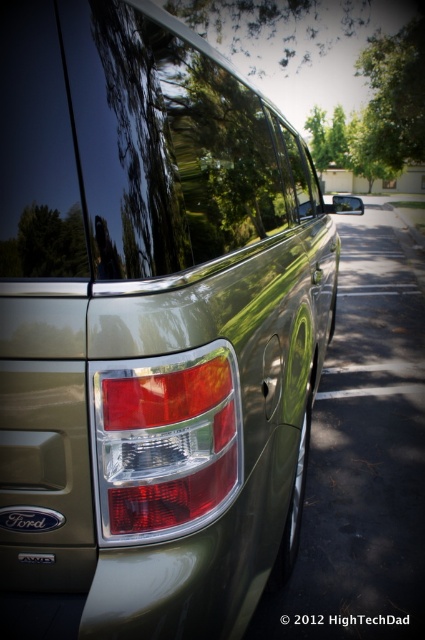
Question: Among these points, which one is farthest from the camera?

Choices:
 (A) (170, 488)
 (B) (190, 52)

Answer: (B)

Question: Which of the following is the farthest from the observer?

Choices:
 (A) (186, 76)
 (B) (384, 67)
 (C) (156, 444)

Answer: (B)

Question: Which object is the closest to the green leafy tree at upper center?

Choices:
 (A) matte plastic tail light at center
 (B) glossy metallic car window at center

Answer: (A)

Question: Is glossy metallic car window at center further to the viewer compared to black plastic license plate at lower center?

Choices:
 (A) no
 (B) yes

Answer: (A)

Question: Can you confirm if glossy metallic car window at center is smaller than black plastic license plate at lower center?

Choices:
 (A) yes
 (B) no

Answer: (B)

Question: Is glossy metallic car window at center to the left of black plastic license plate at lower center from the viewer's perspective?

Choices:
 (A) no
 (B) yes

Answer: (A)